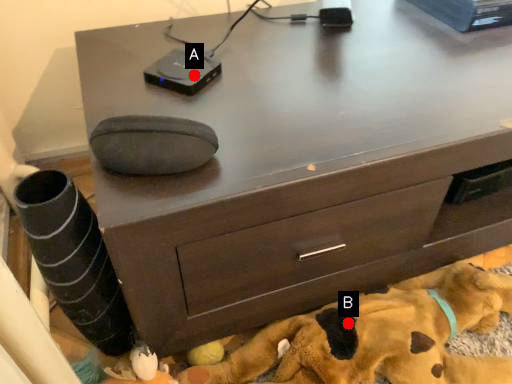
Question: Two points are circled on the image, labeled by A and B beside each circle. Which point appears closest to the camera in this image?

Choices:
 (A) A is closer
 (B) B is closer

Answer: (A)